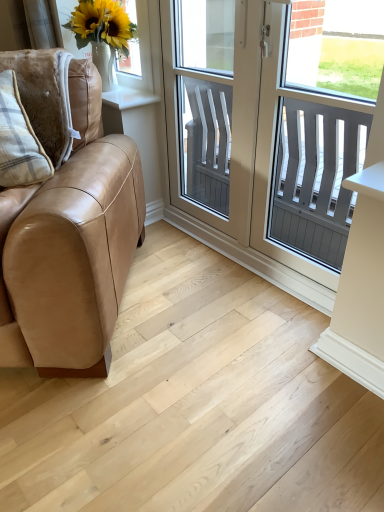
The image size is (384, 512). What are the coordinates of `clear glass screen door at center` in the screenshot? It's located at [x=213, y=106].

Measure the distance between white matte vase at upper left and camera.

white matte vase at upper left and camera are 6.06 feet apart.

What do you see at coordinates (104, 27) in the screenshot? This screenshot has width=384, height=512. I see `white matte vase at upper left` at bounding box center [104, 27].

You are a GUI agent. You are given a task and a screenshot of the screen. Output one action in this format:
    pyautogui.click(x=<x>, y=<y>)
    Task: Click on the clear glass screen door at center
    This screenshot has width=384, height=512.
    Given the screenshot: What is the action you would take?
    pyautogui.click(x=213, y=106)

What's the angular difference between tan leather couch at left and clear glass screen door at center's facing directions?

tan leather couch at left and clear glass screen door at center are facing 46.6 degrees away from each other.

Is tan leather couch at left positioned beyond the bounds of clear glass screen door at center?

Indeed, tan leather couch at left is completely outside clear glass screen door at center.

Between tan leather couch at left and clear glass screen door at center, which one has larger width?

tan leather couch at left is wider.

Between tan leather couch at left and clear glass screen door at center, which one has smaller size?

clear glass screen door at center.

Who is more distant, plaid fabric pillow at left or tan leather couch at left?

plaid fabric pillow at left is further away from the camera.

Could you tell me if plaid fabric pillow at left is facing tan leather couch at left?

Yes, plaid fabric pillow at left is oriented towards tan leather couch at left.

In terms of height, does plaid fabric pillow at left look taller or shorter compared to tan leather couch at left?

plaid fabric pillow at left is shorter than tan leather couch at left.

Is there a large distance between plaid fabric pillow at left and tan leather couch at left?

No, plaid fabric pillow at left is in close proximity to tan leather couch at left.

Who is bigger, plaid fabric pillow at left or clear glass screen door at center?

clear glass screen door at center is bigger.

From a real-world perspective, is plaid fabric pillow at left physically located above or below clear glass screen door at center?

From a real-world perspective, plaid fabric pillow at left is physically above clear glass screen door at center.

Is white matte vase at upper left in front of or behind tan leather couch at left in the image?

Visually, white matte vase at upper left is located behind tan leather couch at left.

The height and width of the screenshot is (512, 384). In order to click on window screen located above the tan leather couch at left (from the image's perspective) in this screenshot , I will do `click(104, 27)`.

From the image's perspective, is white matte vase at upper left under tan leather couch at left?

Actually, white matte vase at upper left appears above tan leather couch at left in the image.

Can you confirm if white matte vase at upper left is shorter than tan leather couch at left?

Correct, white matte vase at upper left is not as tall as tan leather couch at left.

Which is in front, point (216, 21) or point (313, 409)?

The point (313, 409) is closer.

From the image's perspective, between white plastic window at center and light wood floor at lower left, who is located below?

light wood floor at lower left.

Is white plastic window at center inside the boundaries of light wood floor at lower left, or outside?

white plastic window at center is outside light wood floor at lower left.

Between white plastic window at center and light wood floor at lower left, which one has larger width?

With larger width is light wood floor at lower left.

Which is more to the right, clear glass screen door at center or white plastic window at center?

white plastic window at center is more to the right.

Is clear glass screen door at center turned away from white plastic window at center?

Yes, clear glass screen door at center's orientation is away from white plastic window at center.

I want to click on window located in front of the clear glass screen door at center, so click(272, 120).

From a real-world perspective, relative to white plastic window at center, is plaid fabric pillow at left vertically above or below?

plaid fabric pillow at left is above white plastic window at center.

Considering the positions of objects plaid fabric pillow at left and white plastic window at center in the image provided, who is more to the left, plaid fabric pillow at left or white plastic window at center?

plaid fabric pillow at left.

Which is behind, point (25, 126) or point (348, 206)?

The point (348, 206) is farther from the camera.

Looking at the image, does plaid fabric pillow at left seem bigger or smaller compared to white plastic window at center?

plaid fabric pillow at left is smaller than white plastic window at center.

Find the location of a particular element. studio couch that is on the left side of clear glass screen door at center is located at coordinates (71, 247).

Find the location of a particular element. This screenshot has width=384, height=512. pillow located above the tan leather couch at left (from a real-world perspective) is located at coordinates (19, 140).

Estimate the real-world distances between objects in this image. Which object is further from clear glass screen door at center, plaid fabric pillow at left or tan leather couch at left?

Among the two, plaid fabric pillow at left is located further to clear glass screen door at center.

From the image, which object appears to be farther from white matte vase at upper left, tan leather couch at left or plaid fabric pillow at left?

tan leather couch at left is positioned further to the anchor white matte vase at upper left.

Considering their positions, is plaid fabric pillow at left positioned further to clear glass screen door at center than white matte vase at upper left?

Among the two, plaid fabric pillow at left is located further to clear glass screen door at center.

Which object lies nearer to the anchor point plaid fabric pillow at left, tan leather couch at left or clear glass screen door at center?

The object closer to plaid fabric pillow at left is tan leather couch at left.

Based on the photo, looking at the image, which one is located closer to white plastic window at center, clear glass screen door at center or plaid fabric pillow at left?

clear glass screen door at center lies closer to white plastic window at center than the other object.

Based on their spatial positions, is white plastic window at center or white matte vase at upper left closer to plaid fabric pillow at left?

Based on the image, white matte vase at upper left appears to be nearer to plaid fabric pillow at left.

From the image, which object appears to be nearer to light wood floor at lower left, clear glass screen door at center or white plastic window at center?

clear glass screen door at center is closer to light wood floor at lower left.

Considering their positions, is white matte vase at upper left positioned closer to clear glass screen door at center than tan leather couch at left?

white matte vase at upper left lies closer to clear glass screen door at center than the other object.

The width and height of the screenshot is (384, 512). I want to click on pillow that lies between white plastic window at center and light wood floor at lower left from top to bottom, so click(x=19, y=140).

Image resolution: width=384 pixels, height=512 pixels. Identify the location of screen door located between tan leather couch at left and white matte vase at upper left in the depth direction. (213, 106).

Find the location of a particular element. The image size is (384, 512). pillow between tan leather couch at left and white matte vase at upper left from front to back is located at coordinates (19, 140).

The width and height of the screenshot is (384, 512). I want to click on window screen located between plaid fabric pillow at left and white plastic window at center in the left-right direction, so click(104, 27).